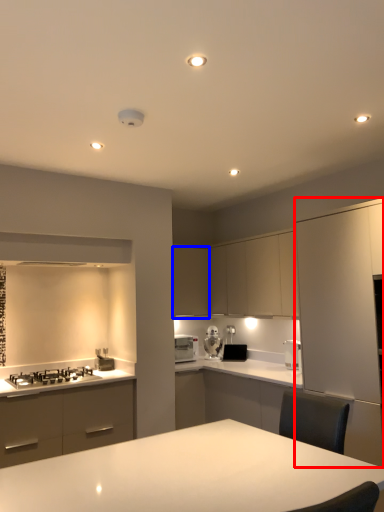
Question: Which point is closer to the camera, cabinetry (highlighted by a red box) or cabinetry (highlighted by a blue box)?

Choices:
 (A) cabinetry
 (B) cabinetry

Answer: (A)